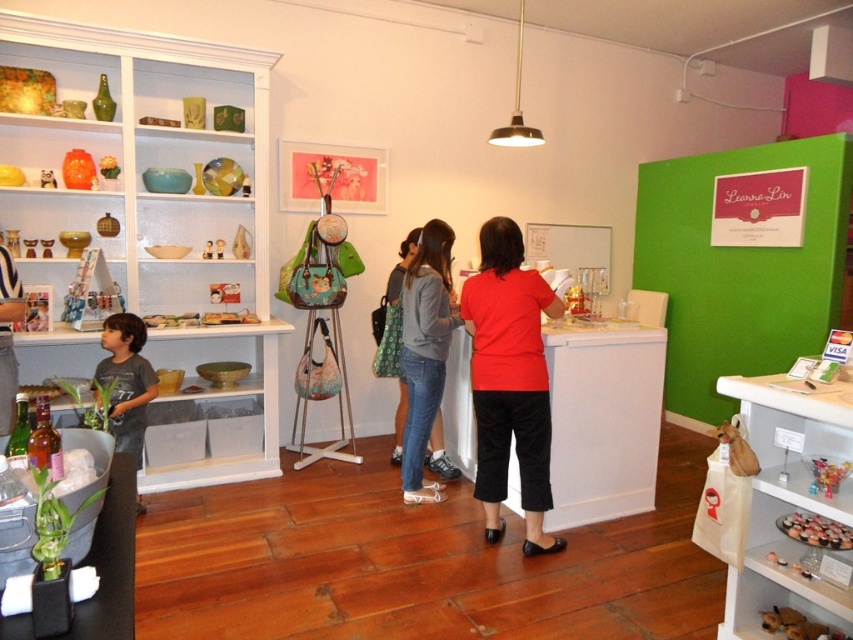
You are a store employee who needs to deliver a product to a customer standing at the counter. The customer is wearing a gray cotton shirt at left and is currently 1.72 meters away from the matte red blouse at center. How far apart are these two customers?

The distance between the matte red blouse at center and the gray cotton shirt at left is 1.72 meters.

You are a customer in the store and want to ask the staff member wearing the matte red blouse at center and denim jeans at center a question. Which piece of clothing is on the left side when facing the staff member?

The denim jeans at center are on the left side when facing the staff member because the matte red blouse at center is positioned on the right side of denim jeans at center.

You are a customer in the store and want to ask both the matte red blouse at center and the gray cotton shirt at left about their sizes. Which one should you approach first if you want to start with the one closer to the entrance?

The gray cotton shirt at left is closer to the entrance than the matte red blouse at center, so you should approach the gray cotton shirt at left first.